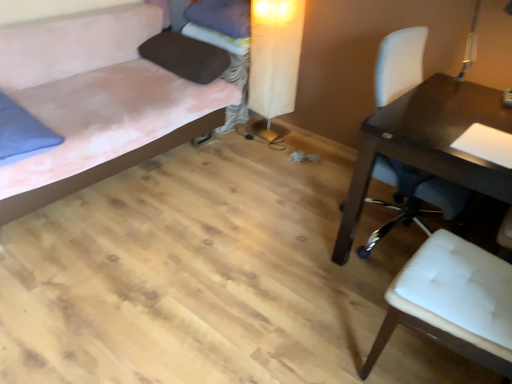
At what (x,y) coordinates should I click in order to perform the action: click on vacant space that's between beige fabric table lamp at center and white leather chair at right, which ranks as the second chair in front-to-back order. Please return your answer as a coordinate pair (x, y). Image resolution: width=512 pixels, height=384 pixels. Looking at the image, I should click on (306, 178).